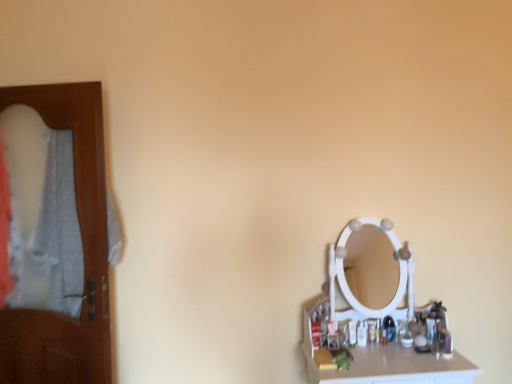
I want to click on free space in front of translucent plastic bottle at right, so click(359, 355).